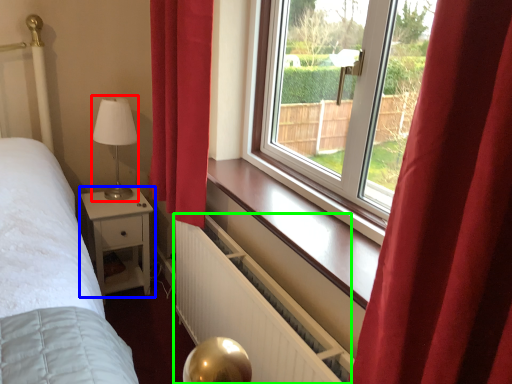
Question: Which object is the closest to the table lamp (highlighted by a red box)? Choose among these: nightstand (highlighted by a blue box) or radiator (highlighted by a green box).

Choices:
 (A) nightstand
 (B) radiator

Answer: (A)